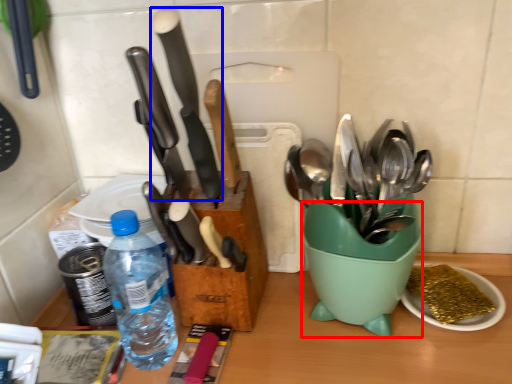
Question: Which object is closer to the camera taking this photo, mixing bowl (highlighted by a red box) or kitchen knife (highlighted by a blue box)?

Choices:
 (A) mixing bowl
 (B) kitchen knife

Answer: (B)